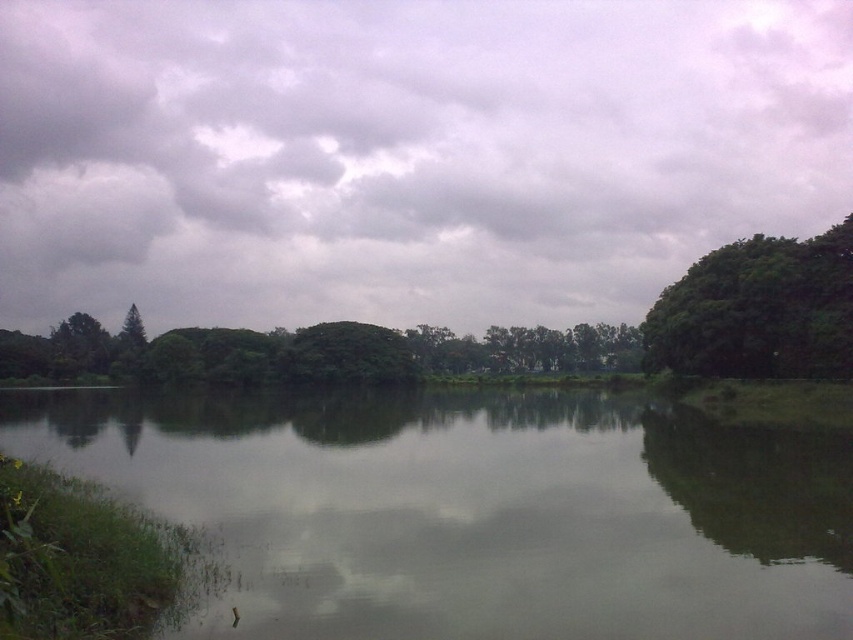
Does cloudy sky at upper center have a lesser height compared to green leafy tree at right?

In fact, cloudy sky at upper center may be taller than green leafy tree at right.

Does cloudy sky at upper center appear under green leafy tree at right?

No.

This screenshot has height=640, width=853. Find the location of `cloudy sky at upper center`. cloudy sky at upper center is located at coordinates coord(404,154).

This screenshot has width=853, height=640. I want to click on cloudy sky at upper center, so click(404, 154).

Who is positioned more to the right, cloudy sky at upper center or green leafy trees at center?

cloudy sky at upper center is more to the right.

Is cloudy sky at upper center thinner than green leafy trees at center?

No.

Is point (366, 81) farther from viewer compared to point (480, 355)?

That is True.

Where is `cloudy sky at upper center`? The height and width of the screenshot is (640, 853). cloudy sky at upper center is located at coordinates (404, 154).

Based on the photo, who is more distant from viewer, (241, 451) or (685, 314)?

The point (685, 314) is behind.

Looking at this image, which is more to the right, green reflective water at center or green leafy tree at right?

Positioned to the right is green leafy tree at right.

Describe the element at coordinates (473, 509) in the screenshot. I see `green reflective water at center` at that location.

Locate an element on the screen. The image size is (853, 640). green reflective water at center is located at coordinates (473, 509).